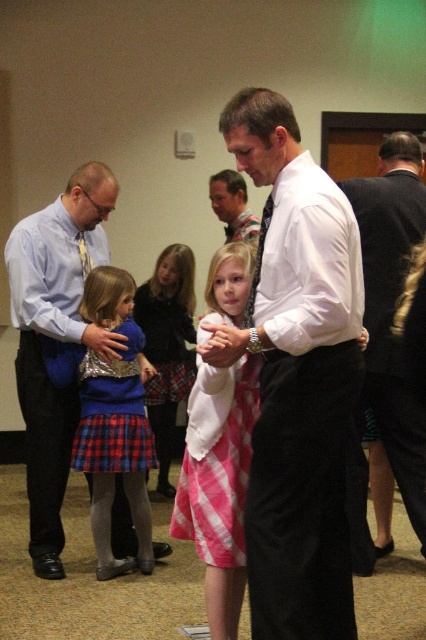
Question: Which object appears farthest from the camera in this image?

Choices:
 (A) matte blue shirt at left
 (B) white smooth dress shirt at center

Answer: (A)

Question: Among these points, which one is nearest to the camera?

Choices:
 (A) (379, 218)
 (B) (253, 323)
 (C) (209, 541)
 (D) (85, 292)

Answer: (B)

Question: Can you confirm if plaid fabric dress at center is smaller than matte blue sweater at lower left?

Choices:
 (A) yes
 (B) no

Answer: (B)

Question: Which of the following is the farthest from the observer?

Choices:
 (A) pink plaid dress at center
 (B) matte blue shirt at left
 (C) matte white shirt at center
 (D) brushed metal tie at left

Answer: (C)

Question: Is pink plaid skirt at center smaller than matte blue sweater at left?

Choices:
 (A) no
 (B) yes

Answer: (A)

Question: Is pink plaid dress at center in front of matte blue sweater at left?

Choices:
 (A) no
 (B) yes

Answer: (B)